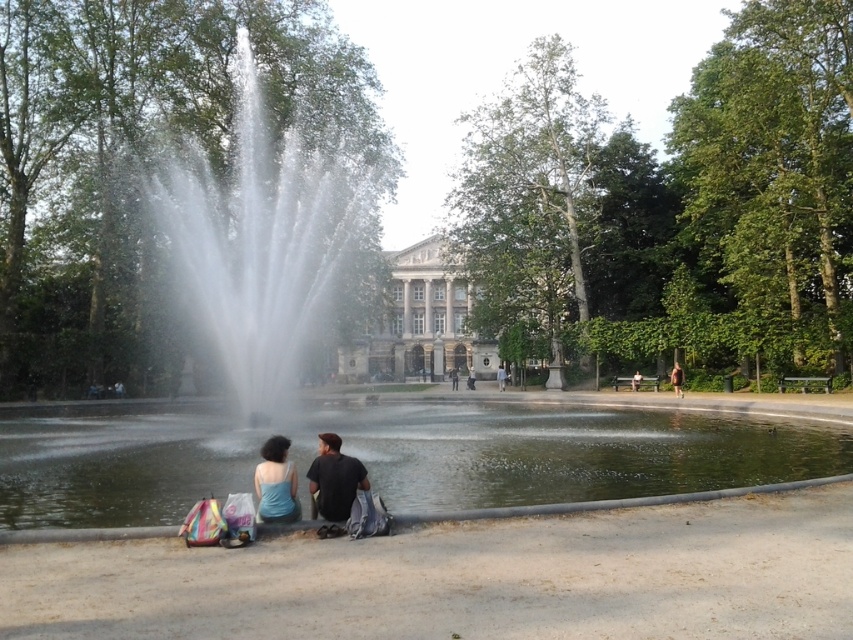
Is point (329, 500) farther from camera compared to point (677, 372)?

No, it is in front of (677, 372).

Which is below, black matte shirt at lower center or brown leather jacket at lower center?

black matte shirt at lower center is below.

The width and height of the screenshot is (853, 640). I want to click on black matte shirt at lower center, so click(334, 480).

Does white stone building at center appear under light blue fabric jacket at center?

No.

Does white stone building at center have a lesser width compared to light blue fabric jacket at center?

Incorrect, white stone building at center's width is not less than light blue fabric jacket at center's.

Image resolution: width=853 pixels, height=640 pixels. I want to click on white stone building at center, so click(422, 323).

Locate an element on the screen. This screenshot has height=640, width=853. white stone building at center is located at coordinates (422, 323).

Between point (384, 486) and point (456, 312), which one is positioned behind?

The point (456, 312) is more distant.

Which is above, clear water at center or white stone building at center?

white stone building at center is higher up.

Is point (824, 444) more distant than point (361, 358)?

No, (824, 444) is in front of (361, 358).

The width and height of the screenshot is (853, 640). In order to click on clear water at center in this screenshot , I will do `click(395, 456)`.